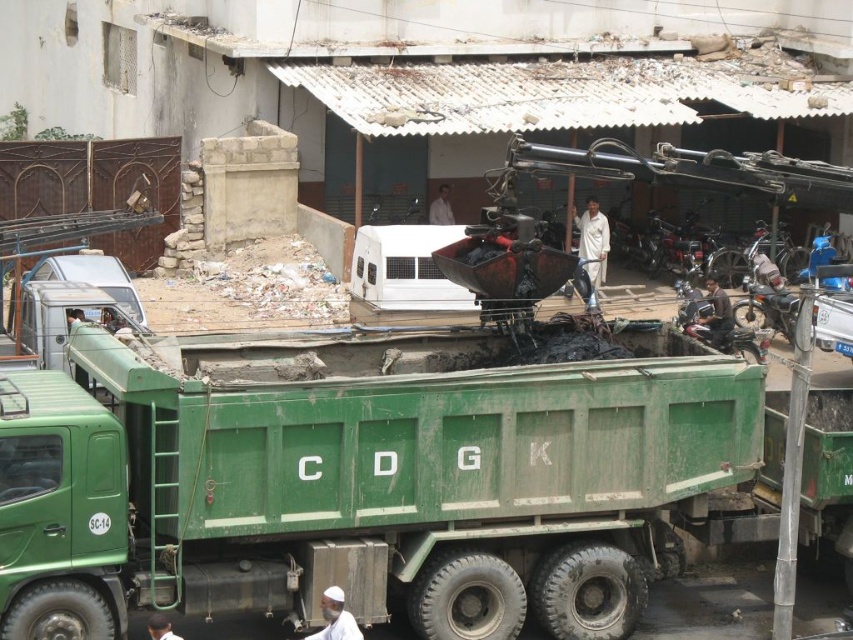
You are a safety inspector at the construction site. You notice two workers wearing a light brown leather jacket at center and a white matte shirt at center. Which worker is standing closer to the ground?

The light brown leather jacket at center is located below the white matte shirt at center, so the worker wearing the light brown leather jacket at center is standing closer to the ground.

You are a delivery person trying to navigate through the construction site. There is a white cotton shirt at center and a white cloth at lower center. Which object is closer to you as you approach the site?

The white cotton shirt at center is closer to you because it is further to the viewer than the white cloth at lower center, meaning it is positioned nearer in the scene.